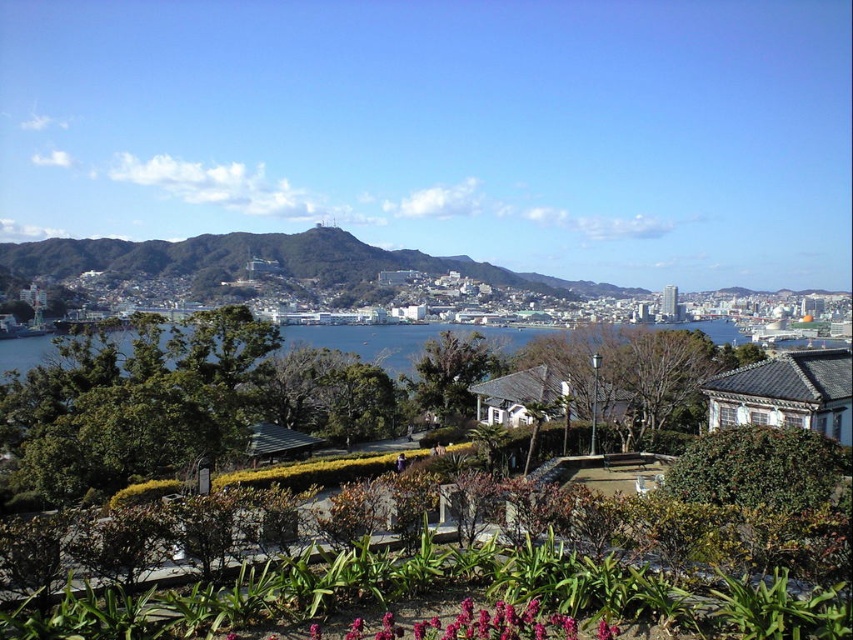
Describe the element at coordinates (485, 554) in the screenshot. I see `green leafy garden at lower center` at that location.

Can you confirm if green leafy garden at lower center is positioned below green grassy hill at center?

Yes, green leafy garden at lower center is below green grassy hill at center.

Between point (708, 612) and point (149, 250), which one is positioned in front?

Point (708, 612)

The image size is (853, 640). What are the coordinates of `green leafy garden at lower center` in the screenshot? It's located at click(485, 554).